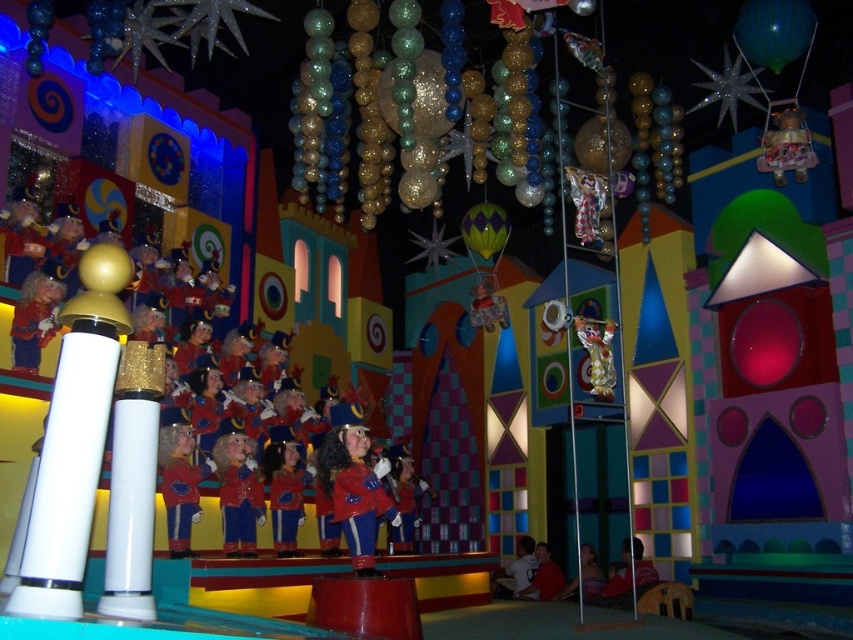
Question: Which of the following is the closest to the observer?

Choices:
 (A) green shiny balloon at upper right
 (B) shiny red uniform at center
 (C) matte red toy at center

Answer: (B)

Question: Does green shiny balloon at upper right lie behind matte red uniform at center?

Choices:
 (A) yes
 (B) no

Answer: (A)

Question: Can you confirm if matte red uniform at center is thinner than shiny blue uniform at center?

Choices:
 (A) yes
 (B) no

Answer: (A)

Question: Considering the relative positions of shiny red uniform at center and green shiny balloon at upper right in the image provided, where is shiny red uniform at center located with respect to green shiny balloon at upper right?

Choices:
 (A) left
 (B) right

Answer: (A)

Question: Considering the real-world distances, which object is farthest from the glittery metallic balloons at upper center?

Choices:
 (A) shiny blue uniform at center
 (B) shiny red uniform at center
 (C) matte red uniform at center

Answer: (C)

Question: Which point is farther from the camera taking this photo?

Choices:
 (A) click(788, 132)
 (B) click(354, 74)

Answer: (A)